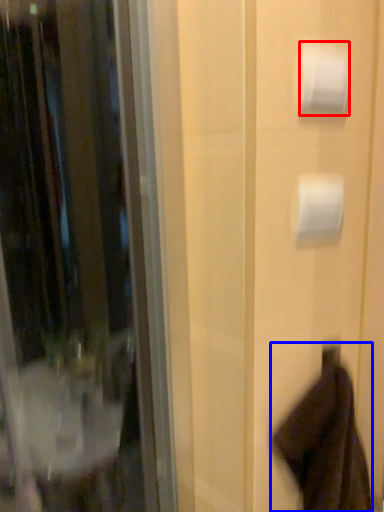
Question: Which object is further to the camera taking this photo, toilet paper (highlighted by a red box) or robe (highlighted by a blue box)?

Choices:
 (A) toilet paper
 (B) robe

Answer: (A)